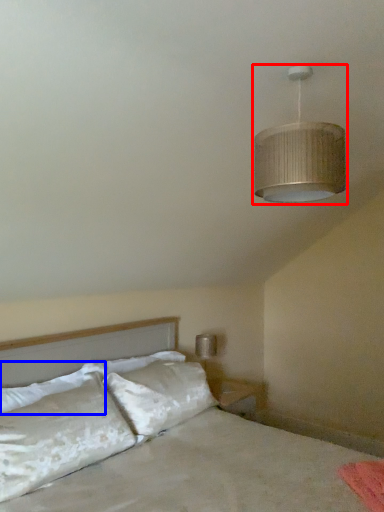
Question: Among these objects, which one is farthest to the camera, lamp (highlighted by a red box) or pillow (highlighted by a blue box)?

Choices:
 (A) lamp
 (B) pillow

Answer: (B)